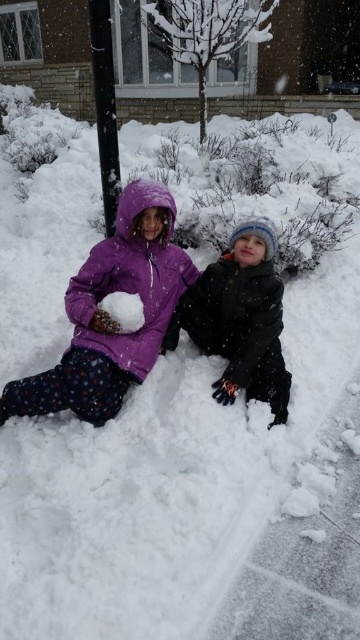
Question: Which object is positioned farthest from the black woolen hat at center?

Choices:
 (A) purple fleece jacket at center
 (B) white fluffy snowball at center
 (C) white concrete pavement at lower center

Answer: (C)

Question: Is black smooth pole at upper center below white fluffy snowball at center?

Choices:
 (A) yes
 (B) no

Answer: (B)

Question: Does purple fleece jacket at center have a larger size compared to white concrete pavement at lower center?

Choices:
 (A) yes
 (B) no

Answer: (A)

Question: Is purple fleece jacket at center to the left of white fluffy snowball at center from the viewer's perspective?

Choices:
 (A) no
 (B) yes

Answer: (A)

Question: Which point appears closest to the camera in this image?

Choices:
 (A) (100, 372)
 (B) (100, 97)
 (C) (137, 294)

Answer: (A)

Question: Which object is the closest to the black woolen hat at center?

Choices:
 (A) black smooth pole at upper center
 (B) white concrete pavement at lower center
 (C) purple fleece jacket at center
 (D) white fluffy snowball at center

Answer: (C)